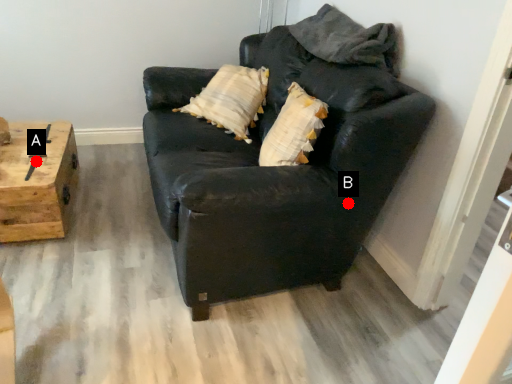
Question: Two points are circled on the image, labeled by A and B beside each circle. Which point is further to the camera?

Choices:
 (A) A is further
 (B) B is further

Answer: (A)